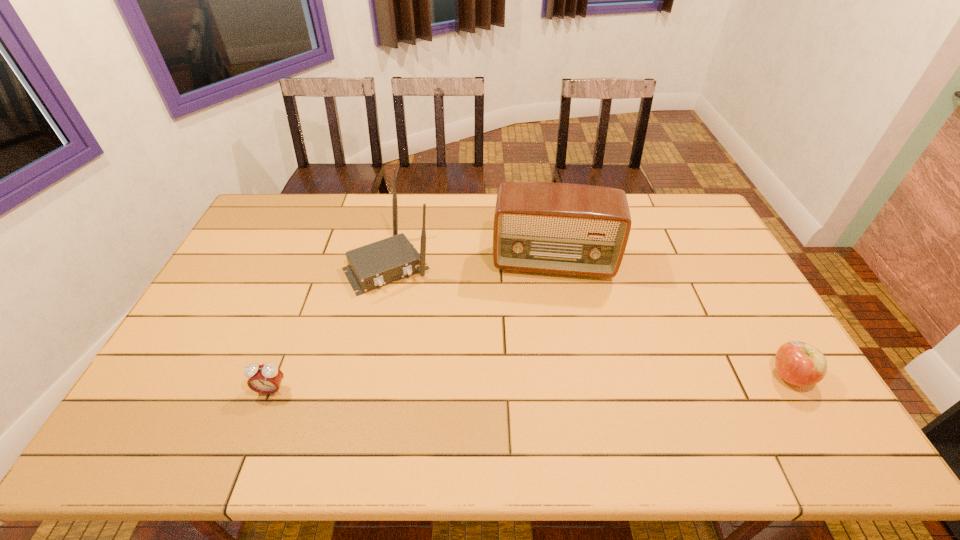
In order to click on free space on the desktop that is between the leftmost object and the apple and is positioned on the front-facing side of the second object from right to left in this screenshot , I will do `click(554, 383)`.

You are a GUI agent. You are given a task and a screenshot of the screen. Output one action in this format:
    pyautogui.click(x=<x>, y=<y>)
    Task: Click on the free space on the desktop that is between the leftmost object and the rightmost object and is positioned on the back of the third object from right to left to connect cables
    The height and width of the screenshot is (540, 960).
    Given the screenshot: What is the action you would take?
    pyautogui.click(x=465, y=385)